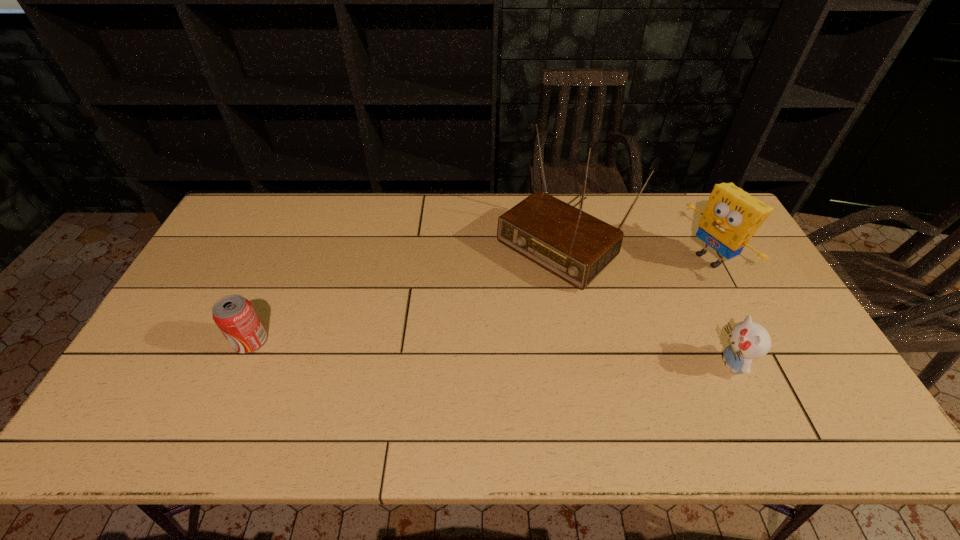
This screenshot has height=540, width=960. Find the location of `vacant space situated on the front panel of the tallest object`. vacant space situated on the front panel of the tallest object is located at coordinates (479, 312).

Locate an element on the screen. The width and height of the screenshot is (960, 540). vacant space located 0.200m on the front panel of the tallest object is located at coordinates (474, 316).

Image resolution: width=960 pixels, height=540 pixels. I want to click on free spot located 0.140m on the face of the sponge, so click(661, 289).

Image resolution: width=960 pixels, height=540 pixels. Find the location of `free spot located 0.160m on the face of the sponge`. free spot located 0.160m on the face of the sponge is located at coordinates (657, 291).

Where is `free space located on the face of the sponge`? This screenshot has width=960, height=540. free space located on the face of the sponge is located at coordinates (661, 289).

The height and width of the screenshot is (540, 960). I want to click on radio_receiver located at the far edge, so click(570, 243).

This screenshot has height=540, width=960. What are the coordinates of `sponge at the far edge` in the screenshot? It's located at (732, 216).

At what (x,y) coordinates should I click in order to perform the action: click on object present at the near edge. Please return your answer as a coordinate pair (x, y). Image resolution: width=960 pixels, height=540 pixels. Looking at the image, I should click on (748, 340).

The width and height of the screenshot is (960, 540). Identify the location of object that is positioned at the right edge. (732, 216).

Identify the location of object that is at the far right corner. The image size is (960, 540). 732,216.